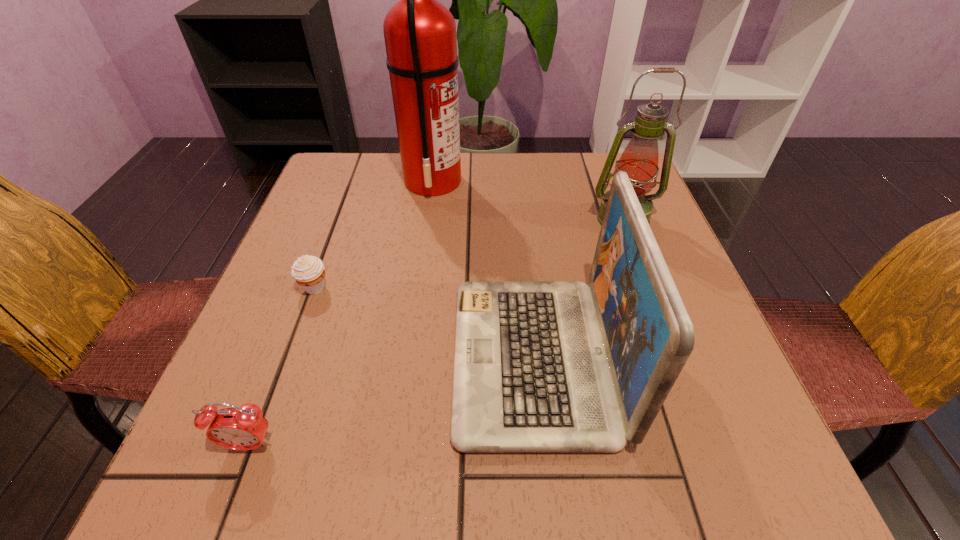
Image resolution: width=960 pixels, height=540 pixels. I want to click on vacant area that lies between the fire extinguisher and the third shortest object, so click(484, 269).

What are the coordinates of `unoccupied position between the alarm clock and the muffin` in the screenshot? It's located at (282, 366).

Locate an element on the screen. Image resolution: width=960 pixels, height=540 pixels. free space between the oil lamp and the tallest object is located at coordinates (528, 200).

At what (x,y) coordinates should I click in order to perform the action: click on vacant region between the oil lamp and the tallest object. Please return your answer as a coordinate pair (x, y). This screenshot has height=540, width=960. Looking at the image, I should click on (528, 200).

Find the location of `free point between the third object from right to left and the second object from right to left`. free point between the third object from right to left and the second object from right to left is located at coordinates (484, 269).

Image resolution: width=960 pixels, height=540 pixels. I want to click on empty space that is in between the third object from right to left and the alarm clock, so click(342, 313).

Where is `empty space between the second tallest object and the alarm clock`? empty space between the second tallest object and the alarm clock is located at coordinates (437, 332).

This screenshot has width=960, height=540. I want to click on empty space between the shortest object and the laptop computer, so click(424, 323).

In order to click on unoccupied area between the muffin and the alarm clock in this screenshot , I will do `click(282, 366)`.

Image resolution: width=960 pixels, height=540 pixels. I want to click on object that is the second closest to the third tallest object, so click(244, 428).